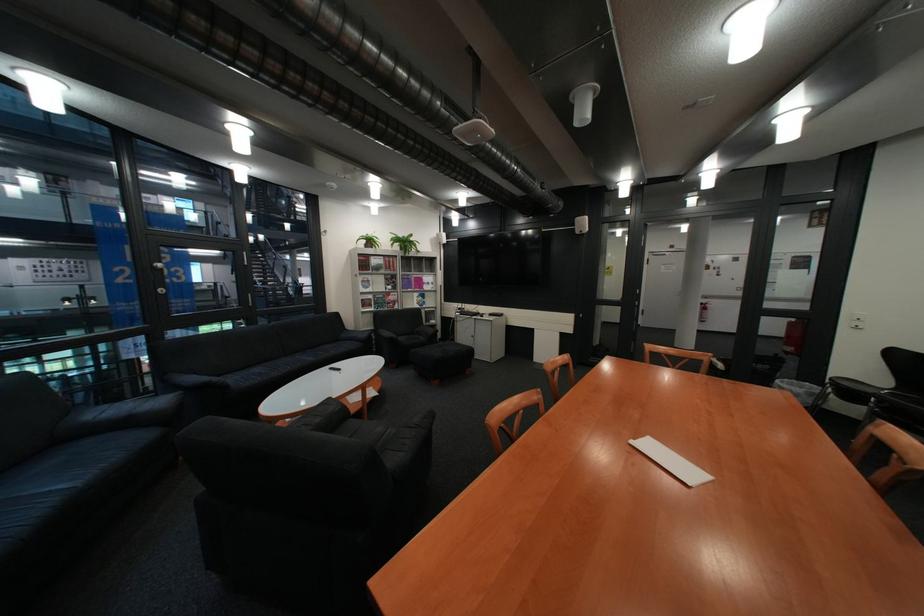
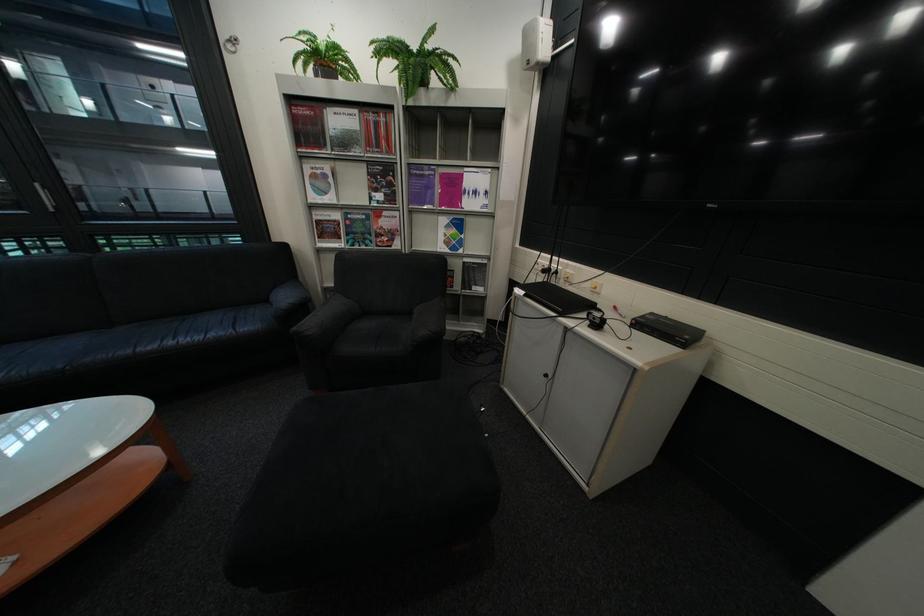
Where in the second image is the point corresponding to (410,285) from the first image?

(409, 192)